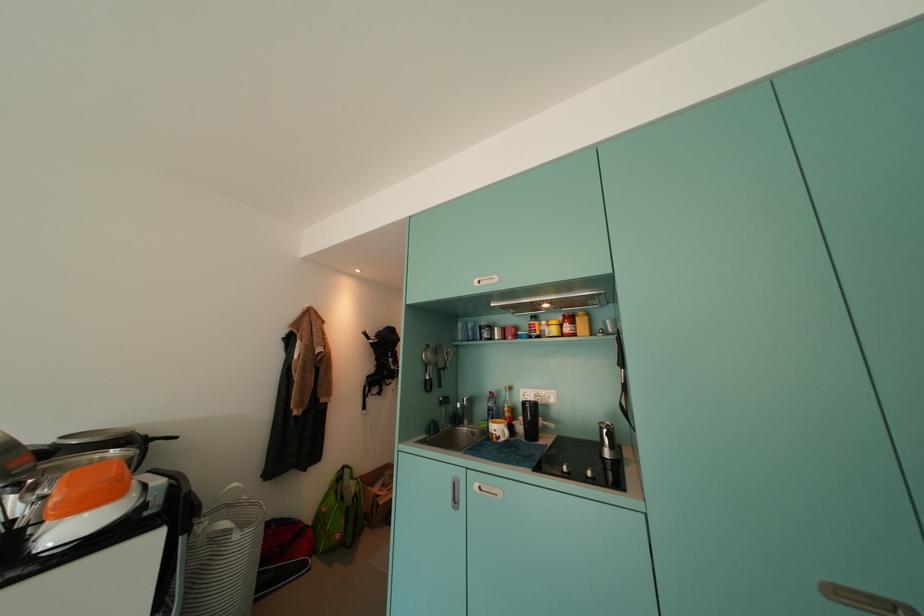
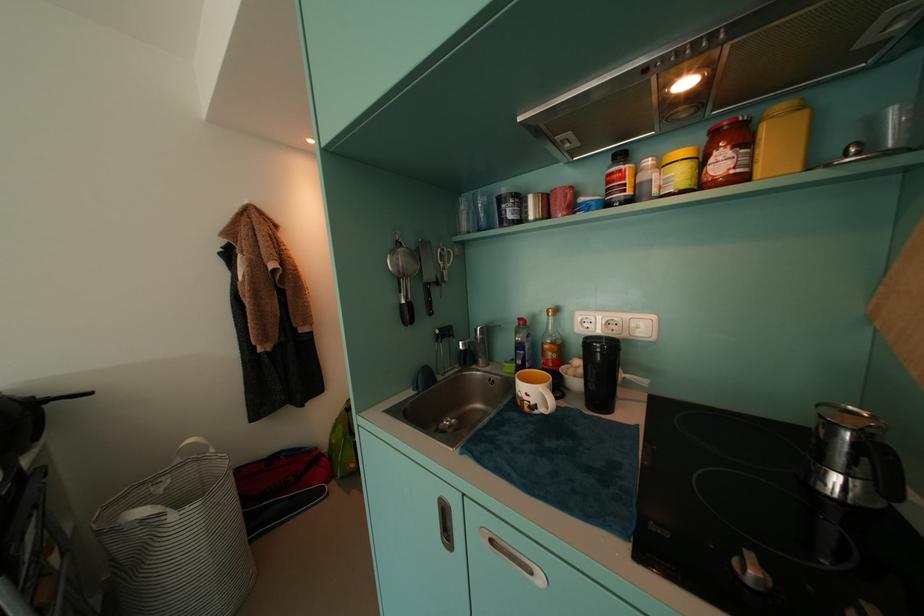
Where in the second image is the point corresponding to [472,424] from the first image?

(488, 363)